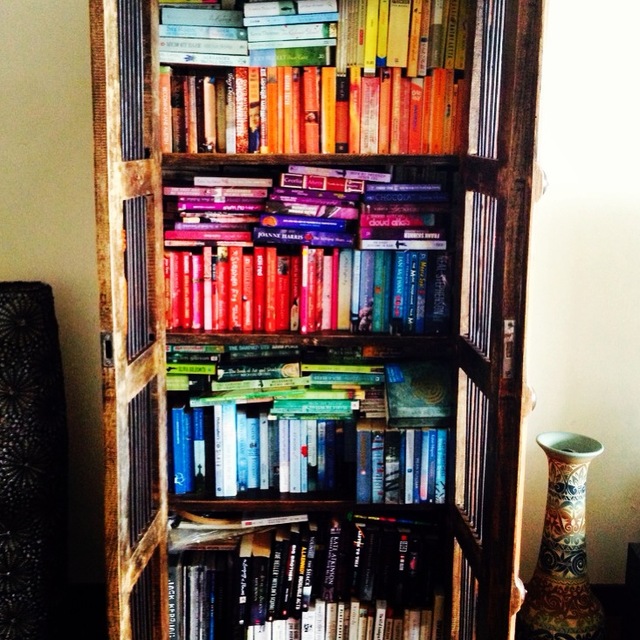
This screenshot has height=640, width=640. Find the location of `bookshelf`. bookshelf is located at coordinates pos(324,290).